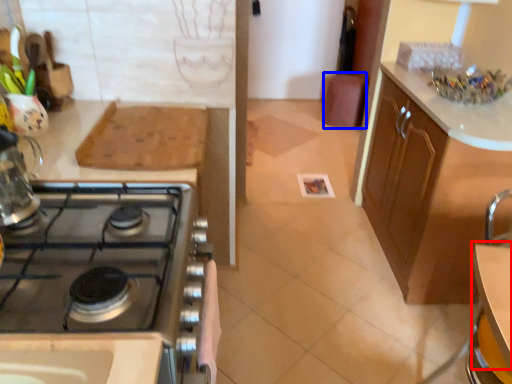
Question: Which of the following is the closest to the observer, table (highlighted by a red box) or bar stool (highlighted by a blue box)?

Choices:
 (A) table
 (B) bar stool

Answer: (A)